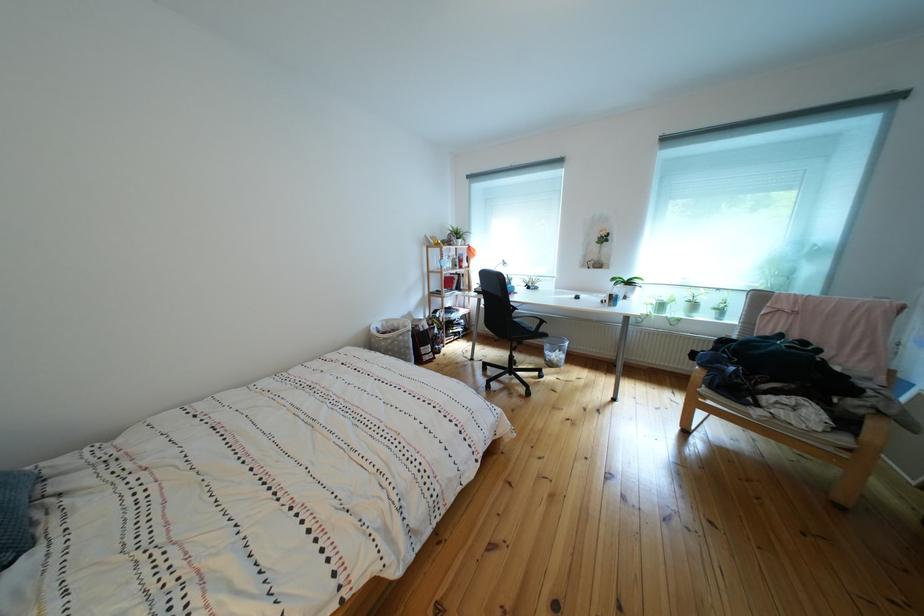
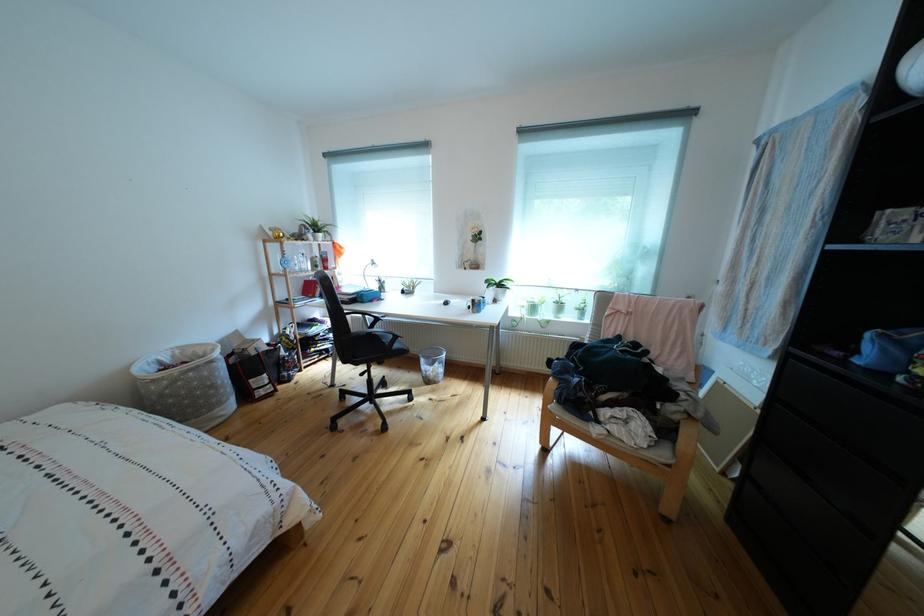
In a continuous first-person perspective shot, in which direction is the camera moving?

The cameraman walked toward right, forward.